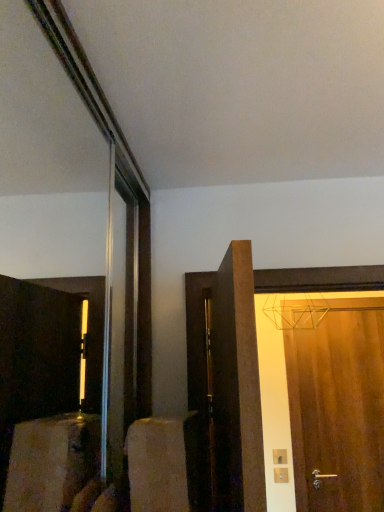
Question: Is wooden door at right, which is the 1th door from right to left, spatially inside dark wood door at center, the second door positioned from the back, or outside of it?

Choices:
 (A) inside
 (B) outside

Answer: (B)

Question: From a real-world perspective, relative to dark wood door at center, the second door in the right-to-left sequence, is wooden door at right, which is the 1th door from right to left, vertically above or below?

Choices:
 (A) above
 (B) below

Answer: (B)

Question: Considering the positions of wooden door at right, placed as the 1th door when sorted from back to front, and dark wood door at center, the second door in the right-to-left sequence, in the image, is wooden door at right, placed as the 1th door when sorted from back to front, bigger or smaller than dark wood door at center, the second door in the right-to-left sequence,?

Choices:
 (A) big
 (B) small

Answer: (B)

Question: Considering the positions of dark wood door at center, the second door in the right-to-left sequence, and wooden door at right, positioned as the 2th door in front-to-back order, in the image, is dark wood door at center, the second door in the right-to-left sequence, taller or shorter than wooden door at right, positioned as the 2th door in front-to-back order,?

Choices:
 (A) short
 (B) tall

Answer: (A)

Question: Is dark wood door at center, which ranks as the 1th door in left-to-right order, inside the boundaries of wooden door at right, placed as the 1th door when sorted from back to front, or outside?

Choices:
 (A) inside
 (B) outside

Answer: (B)

Question: Is point (249, 449) closer or farther from the camera than point (374, 324)?

Choices:
 (A) farther
 (B) closer

Answer: (B)

Question: Considering the positions of dark wood door at center, the first door viewed from the front, and wooden door at right, the second door from the left, in the image, is dark wood door at center, the first door viewed from the front, wider or thinner than wooden door at right, the second door from the left,?

Choices:
 (A) thin
 (B) wide

Answer: (B)